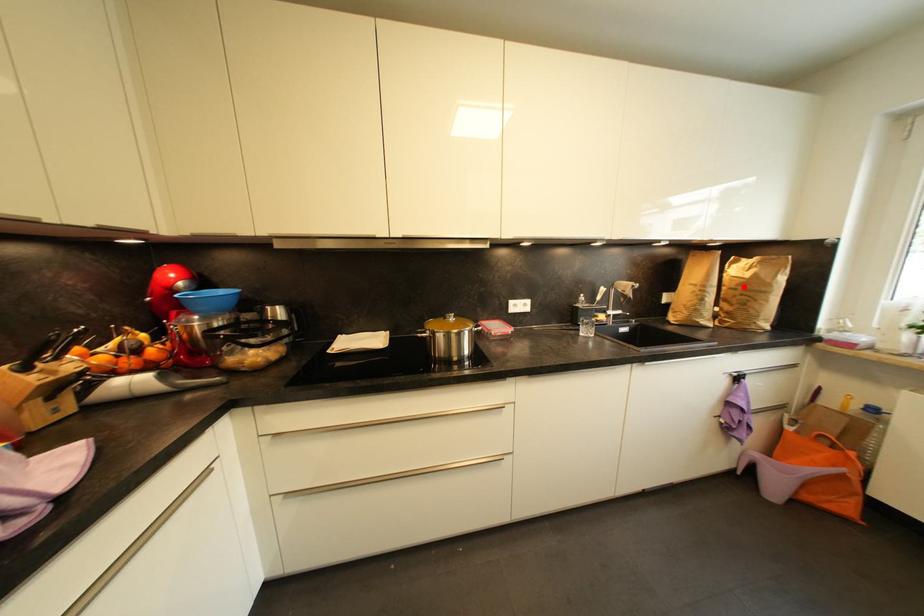
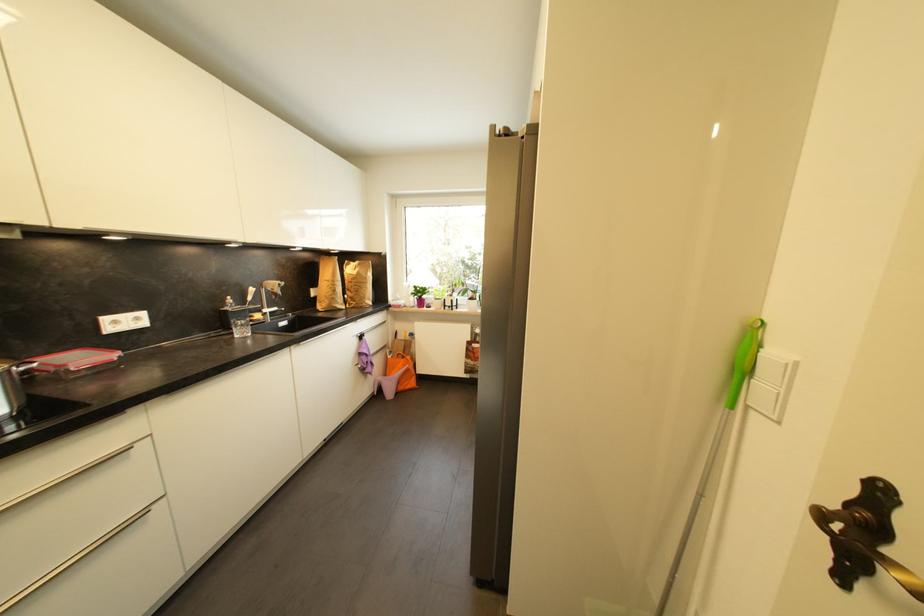
In the second image, find the point that corresponds to the highlighted location in the first image.

(358, 281)